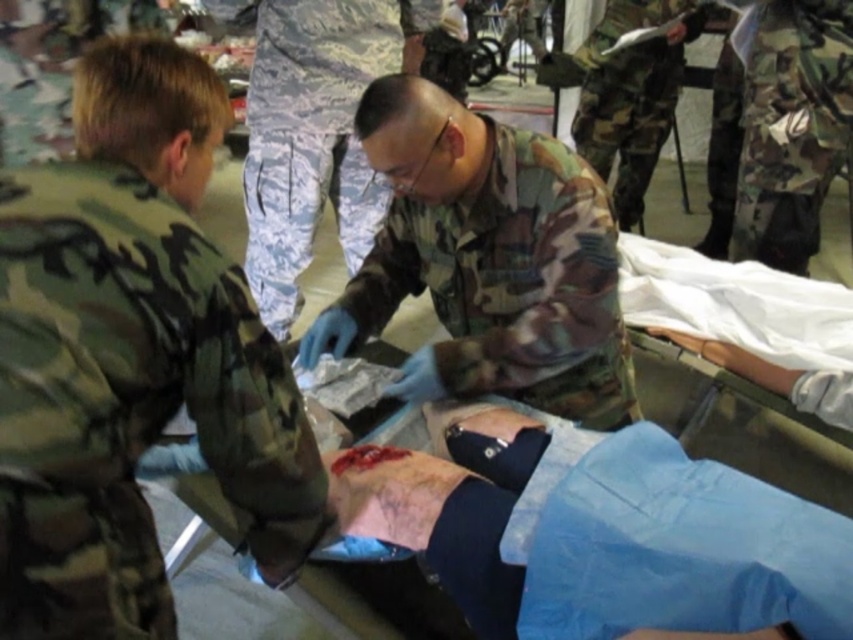
Based on the photo, you are a medic in the field. You need to move the camouflage fabric at left and the camouflage fabric pants at right out of the way to access the patient. Which object should you move first to clear the path?

The camouflage fabric at left is to the left of camouflage fabric pants at right. To clear the path, you should move the camouflage fabric at left first since it is closer to the left side and needs to be moved before the one on the right.

You are a medic in the field and need to quickly assess the distance between the camouflage fabric at left and the camouflage fabric pants at right. Can you fit a 1.5 meter medical kit between them?

The camouflage fabric at left is 1.79 meters away from the camouflage fabric pants at right. Since the medical kit is 1.5 meters long, there is enough space to fit it between them.

Consider the image. You are a medic in the field and need to quickly grab a clean cloth from the medical kit. The digital camouflage pants at center and camouflage fabric uniform at upper center are in your way. Can you reach the medical kit without moving either of them?

The digital camouflage pants at center and camouflage fabric uniform at upper center are 4.24 feet apart, so there is enough space between them to reach the medical kit without moving either of them.